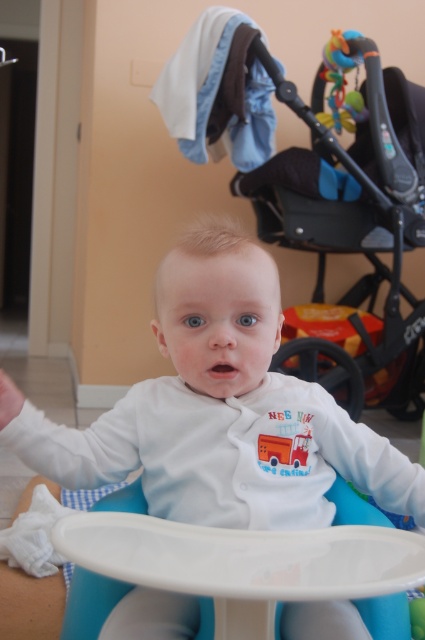
You are a parent trying to put the rubberized plastic teething toy at upper right into the black plastic baby carriage at upper center. Can you place the toy in the carriage without moving either object?

The black plastic baby carriage at upper center is to the right of the rubberized plastic teething toy at upper right, so the toy is already positioned to the left of the carriage. Since the objects are fixed in their positions, you cannot move them to place the toy into the carriage.

You are a parent trying to move the white plastic table at center closer to the baby in the high chair. Which direction should you move it to avoid blocking the path to the black plastic baby carriage at upper center?

You should move the white plastic table at center to the left. Since the black plastic baby carriage at upper center is to the right of the table, moving the table left would keep the path to the carriage clear.

You are a photographer trying to capture a closeup of the baby in the high chair. You notice two points marked in the image. The first point is at coordinate point (410, 477) and the second point is at coordinate point (351, 506). Which point is closer to the baby?

Point (410, 477) is in front of point (351, 506), so it is closer to the baby.